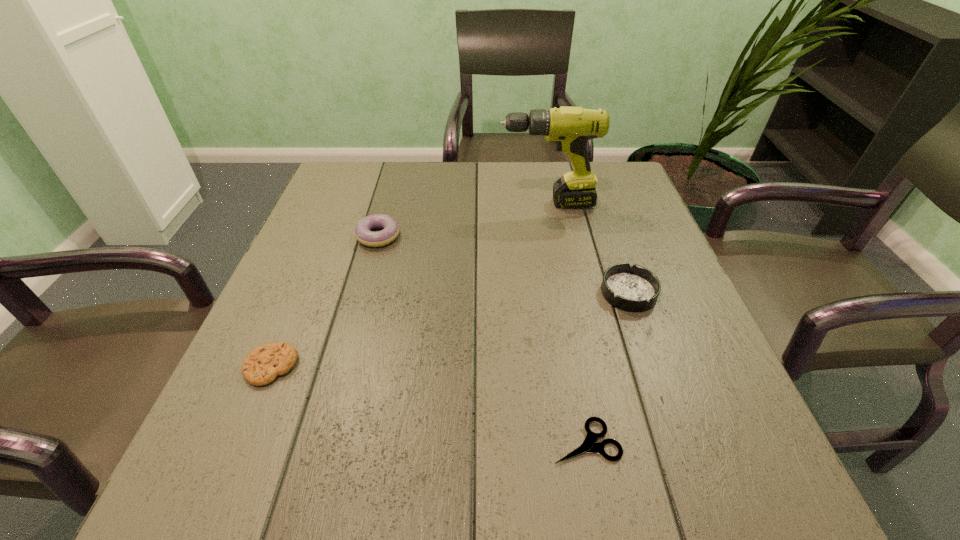
Locate an element on the screen. The width and height of the screenshot is (960, 540). the tallest object is located at coordinates (571, 128).

In order to click on drill in this screenshot , I will do `click(571, 128)`.

The width and height of the screenshot is (960, 540). What are the coordinates of `the fourth nearest object` in the screenshot? It's located at (363, 233).

At what (x,y) coordinates should I click in order to perform the action: click on doughnut. Please return your answer as a coordinate pair (x, y). The width and height of the screenshot is (960, 540). Looking at the image, I should click on (363, 233).

Locate an element on the screen. This screenshot has width=960, height=540. the third tallest object is located at coordinates (635, 288).

At what (x,y) coordinates should I click in order to perform the action: click on ashtray. Please return your answer as a coordinate pair (x, y). The width and height of the screenshot is (960, 540). Looking at the image, I should click on (635, 288).

Where is `the leftmost object`? This screenshot has width=960, height=540. the leftmost object is located at coordinates (262, 365).

Image resolution: width=960 pixels, height=540 pixels. In order to click on the fourth farthest object in this screenshot , I will do `click(262, 365)`.

In order to click on the shortest object in this screenshot , I will do `click(588, 446)`.

This screenshot has height=540, width=960. I want to click on shears, so click(588, 446).